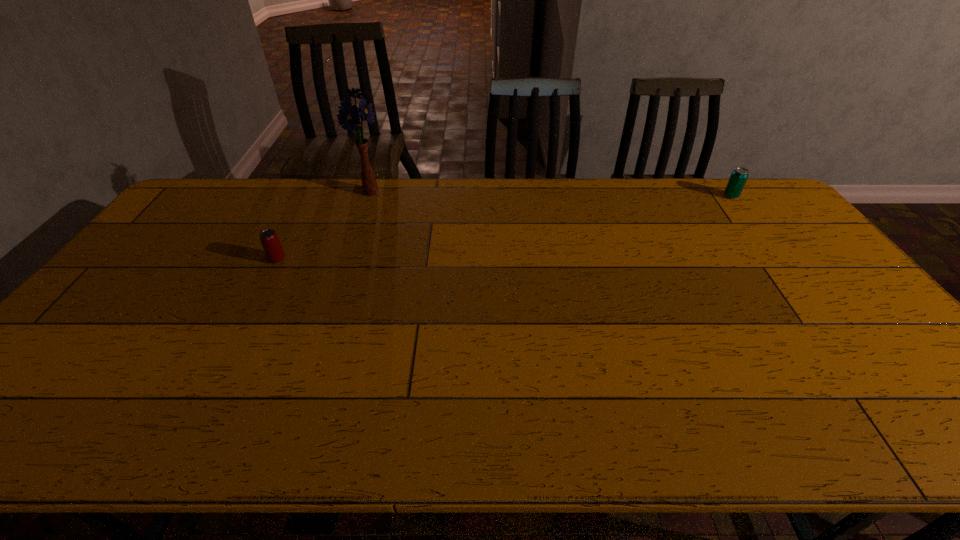
Where is `the tallest object`? the tallest object is located at coordinates (349, 117).

Where is `flower arrangement`? This screenshot has width=960, height=540. flower arrangement is located at coordinates (349, 117).

Locate an element on the screen. The height and width of the screenshot is (540, 960). the farther beer can is located at coordinates (738, 178).

In order to click on the right beer can in this screenshot , I will do `click(738, 178)`.

Find the location of `the nearer beer can`. the nearer beer can is located at coordinates (269, 239).

Find the location of a particular element. The height and width of the screenshot is (540, 960). the leftmost object is located at coordinates (269, 239).

The width and height of the screenshot is (960, 540). Find the location of `free space located on the right of the second object from left to right`. free space located on the right of the second object from left to right is located at coordinates (462, 192).

Where is `vacant area situated 0.360m on the front of the rightmost object`? This screenshot has width=960, height=540. vacant area situated 0.360m on the front of the rightmost object is located at coordinates (784, 267).

Identify the location of vacant area situated on the back of the nearer beer can. The height and width of the screenshot is (540, 960). (308, 200).

This screenshot has height=540, width=960. I want to click on flower arrangement positioned at the far edge, so click(x=349, y=117).